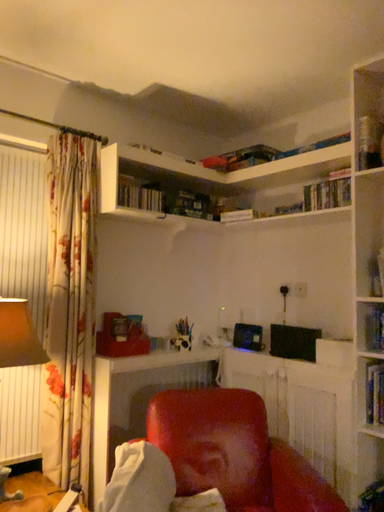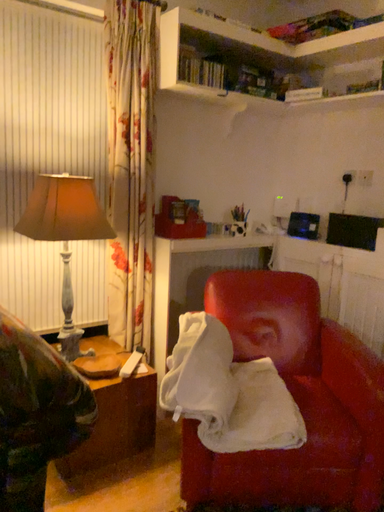
Question: How did the camera likely rotate when shooting the video?

Choices:
 (A) rotated upward
 (B) rotated downward

Answer: (B)